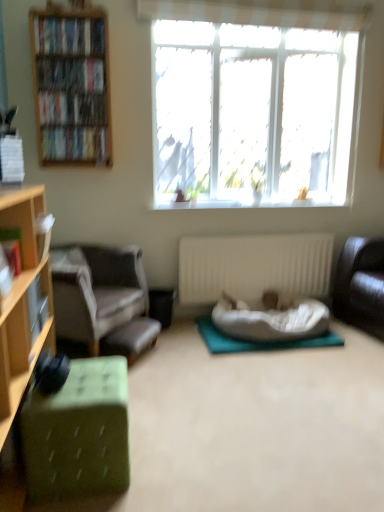
Find the location of `hardcover books at left, which is the third book from back to front`. hardcover books at left, which is the third book from back to front is located at coordinates (70, 75).

In order to click on gray fabric chair at left in this screenshot , I will do `click(102, 298)`.

What do you see at coordinates (270, 320) in the screenshot? This screenshot has width=384, height=512. I see `white plush cushion at center` at bounding box center [270, 320].

Locate an element on the screen. This screenshot has width=384, height=512. transparent glass window at upper center is located at coordinates (255, 108).

What do you see at coordinates (71, 86) in the screenshot? I see `wooden bookshelf at left, acting as the first cabinetry starting from the back` at bounding box center [71, 86].

Find the location of a particular element. The image size is (384, 512). green fabric ottoman at lower left is located at coordinates (79, 432).

Can you tell me how much matte black bookshelf at upper left, marked as the fifth book in a front-to-back arrangement, and hardcover book at left, which appears as the 6th book when viewed from the top, differ in facing direction?

93.8 degrees separate the facing orientations of matte black bookshelf at upper left, marked as the fifth book in a front-to-back arrangement, and hardcover book at left, which appears as the 6th book when viewed from the top.

Could you tell me if matte black bookshelf at upper left, arranged as the 4th book when ordered from the bottom, is turned towards hardcover book at left, which ranks as the first book in bottom-to-top order?

No, matte black bookshelf at upper left, arranged as the 4th book when ordered from the bottom, is not aimed at hardcover book at left, which ranks as the first book in bottom-to-top order.

Visually, is matte black bookshelf at upper left, the 3th book from the top, positioned to the left or to the right of hardcover book at left, acting as the second book starting from the front?

matte black bookshelf at upper left, the 3th book from the top, is to the left of hardcover book at left, acting as the second book starting from the front.

Which of these two, matte black bookshelf at upper left, the 3th book from the top, or hardcover book at left, which ranks as the first book in bottom-to-top order, stands shorter?

With less height is matte black bookshelf at upper left, the 3th book from the top.

Does gray fabric chair at left have a greater width compared to green fabric ottoman at lower left?

Yes, gray fabric chair at left is wider than green fabric ottoman at lower left.

Considering the positions of points (57, 267) and (121, 452), is point (57, 267) farther from camera compared to point (121, 452)?

Yes, it is.

Does gray fabric chair at left have a smaller size compared to green fabric ottoman at lower left?

Actually, gray fabric chair at left might be larger than green fabric ottoman at lower left.

Considering the sizes of objects gray fabric chair at left and green fabric ottoman at lower left in the image provided, who is taller, gray fabric chair at left or green fabric ottoman at lower left?

gray fabric chair at left.

From the image's perspective, is green fabric footrest at lower left above or below hardcover books at left, which is the fourth book in front-to-back order?

Based on their image positions, green fabric footrest at lower left is located beneath hardcover books at left, which is the fourth book in front-to-back order.

Is green fabric footrest at lower left wider than hardcover books at left, positioned as the second book in top-to-bottom order?

Indeed, green fabric footrest at lower left has a greater width compared to hardcover books at left, positioned as the second book in top-to-bottom order.

Is green fabric footrest at lower left further to camera compared to hardcover books at left, which is the third book from back to front?

That is False.

Could hardcover books at left, which is the third book from back to front, be considered to be inside green fabric footrest at lower left?

No, hardcover books at left, which is the third book from back to front, is located outside of green fabric footrest at lower left.

Considering the sizes of objects hardcover book at left, which ranks as the 1th book in front-to-back order, and gray fabric chair at left in the image provided, who is smaller, hardcover book at left, which ranks as the 1th book in front-to-back order, or gray fabric chair at left?

hardcover book at left, which ranks as the 1th book in front-to-back order.

Which of these two, hardcover book at left, the 2th book ordered from the bottom, or gray fabric chair at left, is wider?

Wider between the two is gray fabric chair at left.

From a real-world perspective, which object rests below the other?

gray fabric chair at left, from a real-world perspective.

From the image's perspective, between hardcover book at left, which ranks as the first book in bottom-to-top order, and hardcover book at left, which ranks as the 1th book in front-to-back order, who is located below?

hardcover book at left, which ranks as the first book in bottom-to-top order, is shown below in the image.

Is hardcover book at left, which appears as the 6th book when viewed from the top, in contact with hardcover book at left, placed as the 6th book when sorted from back to front?

No, hardcover book at left, which appears as the 6th book when viewed from the top, is not next to hardcover book at left, placed as the 6th book when sorted from back to front.

Considering the sizes of objects hardcover book at left, which appears as the 6th book when viewed from the top, and hardcover book at left, placed as the 6th book when sorted from back to front, in the image provided, who is shorter, hardcover book at left, which appears as the 6th book when viewed from the top, or hardcover book at left, placed as the 6th book when sorted from back to front,?

hardcover book at left, placed as the 6th book when sorted from back to front, is shorter.

Between hardcover book at left, acting as the second book starting from the front, and hardcover book at left, acting as the fifth book starting from the top, which one is positioned in front?

hardcover book at left, acting as the fifth book starting from the top, is closer to the camera.

From the image's perspective, relative to matte black bookshelf at upper left, marked as the fifth book in a front-to-back arrangement, is teal fabric yoga mat at center above or below?

From the image's perspective, teal fabric yoga mat at center appears below matte black bookshelf at upper left, marked as the fifth book in a front-to-back arrangement.

Is teal fabric yoga mat at center positioned far away from matte black bookshelf at upper left, arranged as the 4th book when ordered from the bottom?

Yes, teal fabric yoga mat at center is far from matte black bookshelf at upper left, arranged as the 4th book when ordered from the bottom.

Can you confirm if teal fabric yoga mat at center is positioned to the right of matte black bookshelf at upper left, which appears as the 2th book when viewed from the back?

Yes, teal fabric yoga mat at center is to the right of matte black bookshelf at upper left, which appears as the 2th book when viewed from the back.

Considering the relative positions of green fabric footrest at lower left and hardcover book at left, the 2th book ordered from the bottom, in the image provided, is green fabric footrest at lower left to the right of hardcover book at left, the 2th book ordered from the bottom, from the viewer's perspective?

Yes, green fabric footrest at lower left is to the right of hardcover book at left, the 2th book ordered from the bottom.

Between green fabric footrest at lower left and hardcover book at left, the 2th book ordered from the bottom, which one has smaller size?

Smaller between the two is hardcover book at left, the 2th book ordered from the bottom.

Could you measure the distance between green fabric footrest at lower left and hardcover book at left, the 2th book ordered from the bottom?

green fabric footrest at lower left is 3.46 feet from hardcover book at left, the 2th book ordered from the bottom.

Is green fabric footrest at lower left aimed at hardcover book at left, the 2th book ordered from the bottom?

No, green fabric footrest at lower left is not aimed at hardcover book at left, the 2th book ordered from the bottom.

There is a hardcover book at left, which appears as the 6th book when viewed from the top. Where is `the 3rd book above it (from a real-world perspective)`? the 3rd book above it (from a real-world perspective) is located at coordinates (72, 109).

Locate an element on the screen. Image resolution: width=384 pixels, height=512 pixels. desk below the gray fabric chair at left (from the image's perspective) is located at coordinates (79, 432).

Estimate the real-world distances between objects in this image. Which object is closer to green fabric ottoman at lower left, teal fabric yoga mat at center or hardcover books at upper left, the third book from the front?

Based on the image, teal fabric yoga mat at center appears to be nearer to green fabric ottoman at lower left.

Considering their positions, is transparent glass window at upper center positioned closer to hardcover book at left, placed as the 6th book when sorted from back to front, than green fabric footrest at lower left?

The object closer to hardcover book at left, placed as the 6th book when sorted from back to front, is green fabric footrest at lower left.

Which object lies further to the anchor point transparent glass window at upper center, gray fabric chair at left or leather couch at right?

gray fabric chair at left.

From the image, which object appears to be nearer to hardcover book at left, the 2th book ordered from the bottom, white plush cushion at center or hardcover books at upper left, acting as the first book starting from the top?

hardcover books at upper left, acting as the first book starting from the top, is closer to hardcover book at left, the 2th book ordered from the bottom.

Which object lies nearer to the anchor point hardcover book at left, marked as the 5th book in a back-to-front arrangement, hardcover book at upper left, the 1th book when ordered from back to front, or matte black bookshelf at upper left, the 3th book from the top?

hardcover book at upper left, the 1th book when ordered from back to front.

Looking at the image, which one is located further to gray fabric chair at left, leather couch at right or hardcover books at upper left, arranged as the 4th book when viewed from the back?

Based on the image, leather couch at right appears to be further to gray fabric chair at left.

Looking at the image, which one is located further to hardcover books at left, marked as the 5th book in a bottom-to-top arrangement, green fabric ottoman at lower left, which is counted as the second cabinetry, starting from the top, or matte black bookshelf at upper left, marked as the fifth book in a front-to-back arrangement?

Based on the image, green fabric ottoman at lower left, which is counted as the second cabinetry, starting from the top, appears to be further to hardcover books at left, marked as the 5th book in a bottom-to-top arrangement.

Estimate the real-world distances between objects in this image. Which object is closer to hardcover book at upper left, acting as the fourth book starting from the top, white ribbed radiator at center or leather couch at right?

white ribbed radiator at center lies closer to hardcover book at upper left, acting as the fourth book starting from the top, than the other object.

This screenshot has height=512, width=384. What are the coordinates of `the footrest located between gray fabric chair at left and white ribbed radiator at center in the left-right direction` in the screenshot? It's located at (131, 338).

Locate an element on the screen. yoga mat between matte black bookshelf at upper left, marked as the fifth book in a front-to-back arrangement, and green fabric ottoman at lower left in the up-down direction is located at coordinates (257, 341).

Identify the location of radiator between hardcover books at upper left, acting as the first book starting from the top, and gray fabric chair at left from top to bottom. Image resolution: width=384 pixels, height=512 pixels. (254, 266).

This screenshot has height=512, width=384. What are the coordinates of `window between hardcover books at upper left, acting as the first book starting from the top, and green fabric ottoman at lower left, in the vertical direction` in the screenshot? It's located at (255, 108).